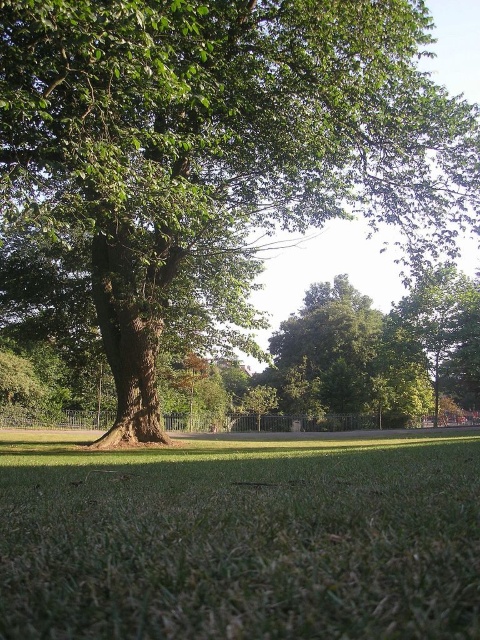
Is green grassy at center to the left of green leafy tree at upper right from the viewer's perspective?

Correct, you'll find green grassy at center to the left of green leafy tree at upper right.

Who is more forward, (40, 556) or (433, 321)?

Point (40, 556) is more forward.

Is point (395, 516) positioned in front of point (394, 321)?

That is True.

This screenshot has height=640, width=480. What are the coordinates of `green grassy at center` in the screenshot? It's located at (240, 540).

Measure the distance between green leafy tree at center and green leafy tree at upper right.

green leafy tree at center and green leafy tree at upper right are 16.55 meters apart from each other.

Who is more forward, (2, 97) or (443, 384)?

Point (2, 97) is more forward.

Where is `green leafy tree at center`? This screenshot has height=640, width=480. green leafy tree at center is located at coordinates [218, 141].

Between green leafy tree at center and green grassy at center, which one appears on the left side from the viewer's perspective?

Positioned to the left is green grassy at center.

Describe the element at coordinates (218, 141) in the screenshot. The height and width of the screenshot is (640, 480). I see `green leafy tree at center` at that location.

Between point (218, 246) and point (462, 464), which one is positioned in front?

Point (462, 464)

Where is `green leafy tree at center`? Image resolution: width=480 pixels, height=640 pixels. green leafy tree at center is located at coordinates (218, 141).